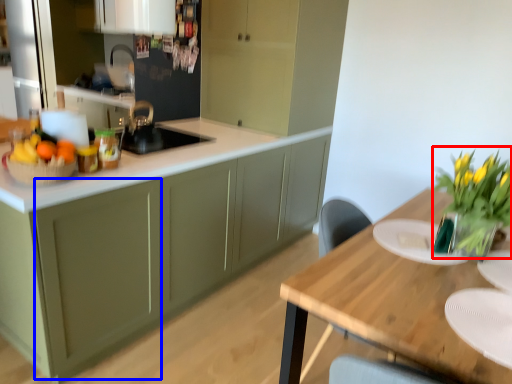
Question: Among these objects, which one is farthest to the camera, floral arrangement (highlighted by a red box) or cabinetry (highlighted by a blue box)?

Choices:
 (A) floral arrangement
 (B) cabinetry

Answer: (B)